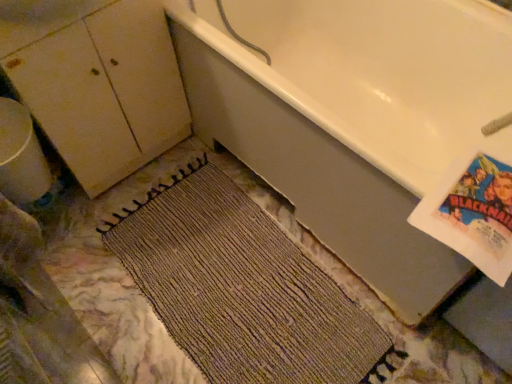
Question: From the image's perspective, relative to white glossy bathtub at upper right, is white glossy cabinet at upper left above or below?

Choices:
 (A) above
 (B) below

Answer: (A)

Question: In terms of width, does white glossy cabinet at upper left look wider or thinner when compared to white glossy bathtub at upper right?

Choices:
 (A) wide
 (B) thin

Answer: (B)

Question: Which is farther from the matte white cabinet at left?

Choices:
 (A) white glossy cabinet at upper left
 (B) brown woven mat at center
 (C) white glossy bathtub at upper right

Answer: (B)

Question: Which is farther from the matte white cabinet at left?

Choices:
 (A) brown woven mat at center
 (B) white glossy cabinet at upper left
 (C) white glossy bathtub at upper right

Answer: (A)